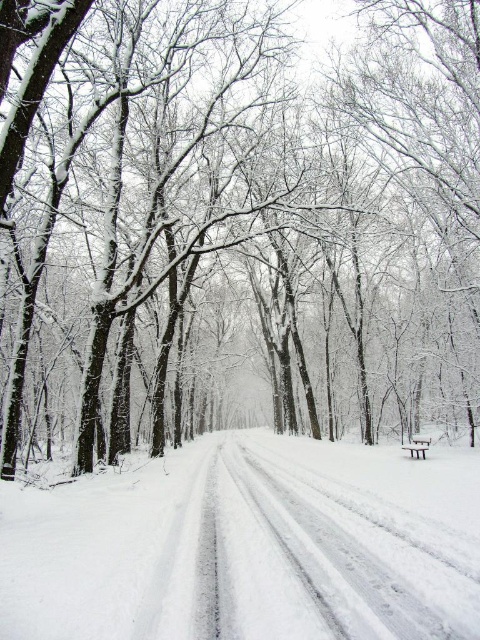
From the picture: You are a hiker who wants to sit on the wooden park bench at center. However, there is white powdery snow at center covering it. Can you sit on the bench without removing the snow?

The white powdery snow at center is positioned over wooden park bench at center, so the snow is covering the bench. You can sit on the bench, but you will need to clear the snow first to avoid getting wet.